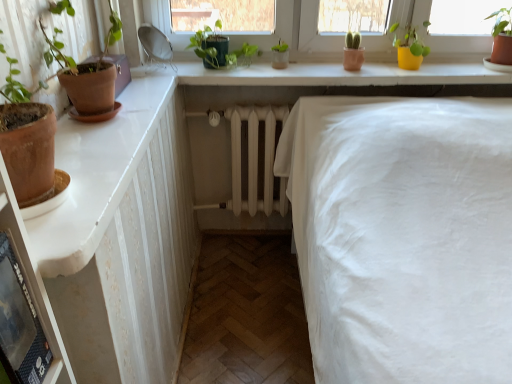
The height and width of the screenshot is (384, 512). I want to click on free spot below green matte plant at upper center, acting as the 1th houseplant starting from the left (from a real-world perspective), so click(x=229, y=68).